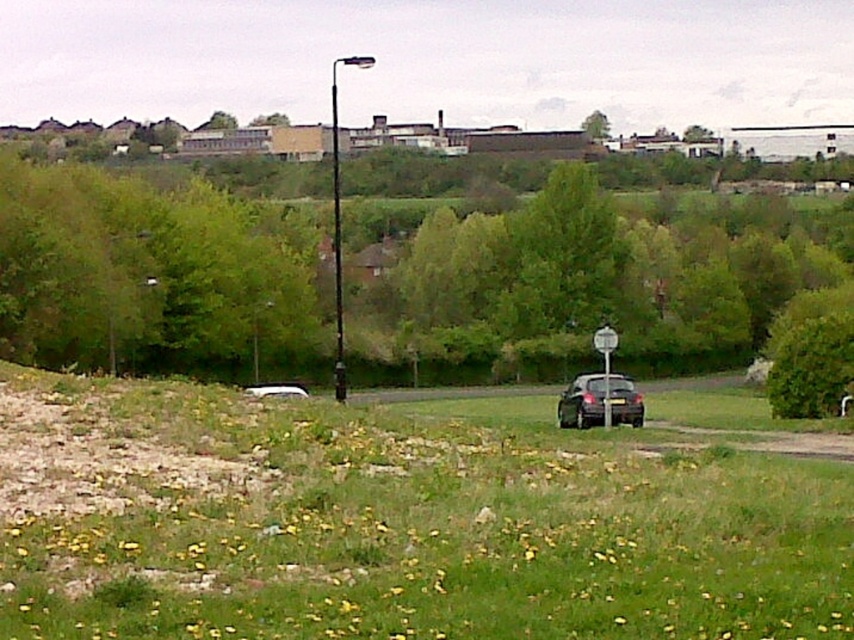
You are standing at the point marked by the coordinates point (154, 276) in the image. What is the closest object to you in the scene?

The closest object to you at point (154, 276) is the green leafy tree at center, as the coordinates mark its location.

You are standing on the grassy area with yellow dandelions and want to walk to the metallic silver street sign at center. Which direction should you walk relative to the green leafy tree at center?

You should walk to the right of the green leafy tree at center because the metallic silver street sign at center is located to the right of the green leafy tree at center.